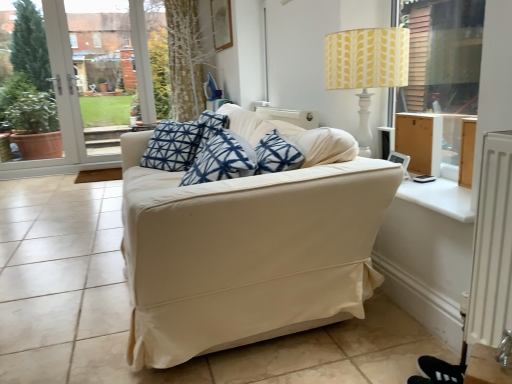
You are a GUI agent. You are given a task and a screenshot of the screen. Output one action in this format:
    pyautogui.click(x=<x>, y=<y>)
    Task: Click on the vacant area on top of white smooth window sill at right (from a real-world perspective)
    This screenshot has width=512, height=384.
    Given the screenshot: What is the action you would take?
    pyautogui.click(x=437, y=190)